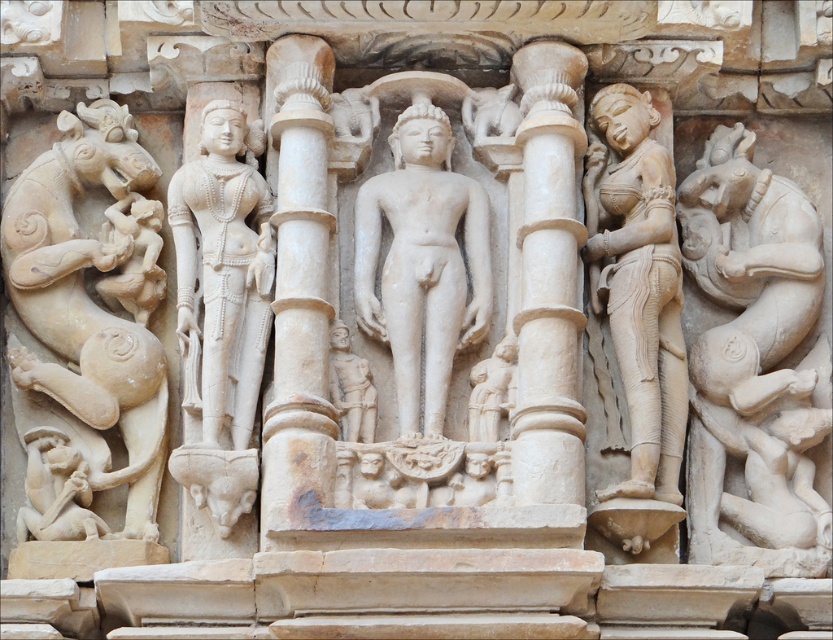
Question: Estimate the real-world distances between objects in this image. Which object is farther from the beige stone sculpture at left?

Choices:
 (A) white marble column at center
 (B) white stone elephant at right
 (C) smooth beige statue at right
 (D) white marble statue at center

Answer: (B)

Question: Observing the image, what is the correct spatial positioning of white marble statue at left in reference to white marble column at center?

Choices:
 (A) right
 (B) left

Answer: (B)

Question: Can you confirm if white marble statue at center is positioned to the left of white marble column at center?

Choices:
 (A) no
 (B) yes

Answer: (A)

Question: Does beige stone sculpture at left appear under smooth beige statue at right?

Choices:
 (A) yes
 (B) no

Answer: (A)

Question: Which point is farther from the camera taking this photo?

Choices:
 (A) (203, 176)
 (B) (772, 276)

Answer: (B)

Question: Which point is closer to the camera?

Choices:
 (A) smooth beige statue at right
 (B) white marble column at center

Answer: (B)